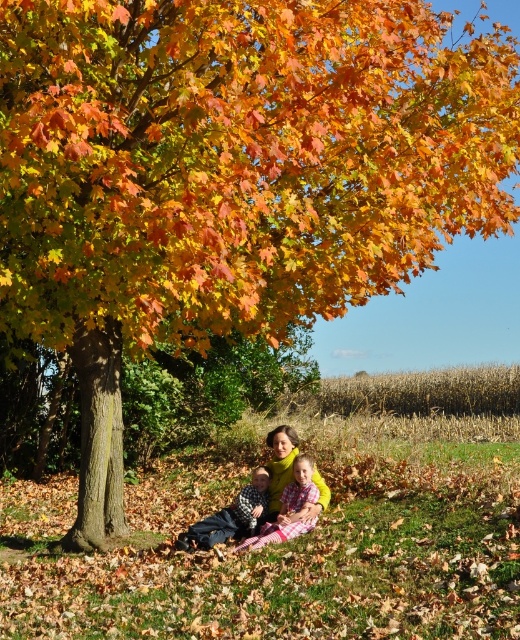
Who is more distant from viewer, (286, 492) or (282, 426)?

The point (282, 426) is behind.

Is yellow fabric at lower center in front of yellow wool scarf at center?

Yes, it is.

What do you see at coordinates (291, 508) in the screenshot? I see `yellow fabric at lower center` at bounding box center [291, 508].

I want to click on yellow fabric at lower center, so click(x=291, y=508).

Is yellow wool scarf at center further to the viewer compared to matte black jacket at lower center?

Yes.

Which is behind, point (281, 440) or point (245, 531)?

Positioned behind is point (281, 440).

Which is in front, point (275, 476) or point (258, 474)?

Positioned in front is point (258, 474).

The image size is (520, 640). What are the coordinates of `yellow wool scarf at center` in the screenshot? It's located at pyautogui.click(x=279, y=465).

Can you confirm if yellow fabric at lower center is positioned above matte black jacket at lower center?

Indeed, yellow fabric at lower center is positioned over matte black jacket at lower center.

Between yellow fabric at lower center and matte black jacket at lower center, which one appears on the right side from the viewer's perspective?

From the viewer's perspective, yellow fabric at lower center appears more on the right side.

Locate an element on the screen. The image size is (520, 640). yellow fabric at lower center is located at coordinates (291, 508).

Locate an element on the screen. yellow fabric at lower center is located at coordinates (291, 508).